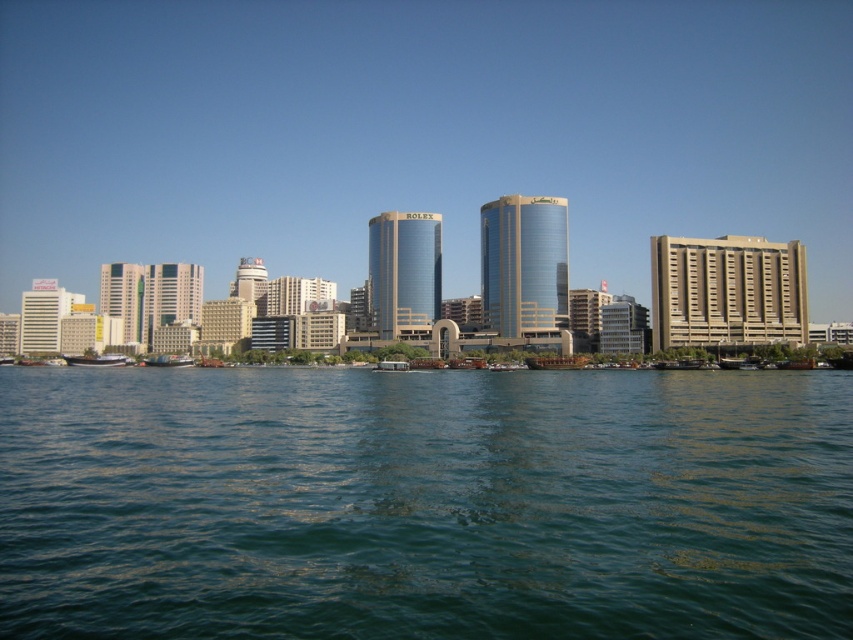
You are standing on a pier overlooking the city. You notice a point marked at coordinates (424, 502). What object is located at that point?

The greenish blue water at center is located at point (424, 502).

You are a delivery person who needs to transport a large package that requires a boat with a minimum width of 2 meters. You see the green plastic boat at lower left and the wooden planks boat at center. Which boat can accommodate your package?

The green plastic boat at lower left has a greater width than the wooden planks boat at center, so it can accommodate the large package if its width meets or exceeds 2 meters.